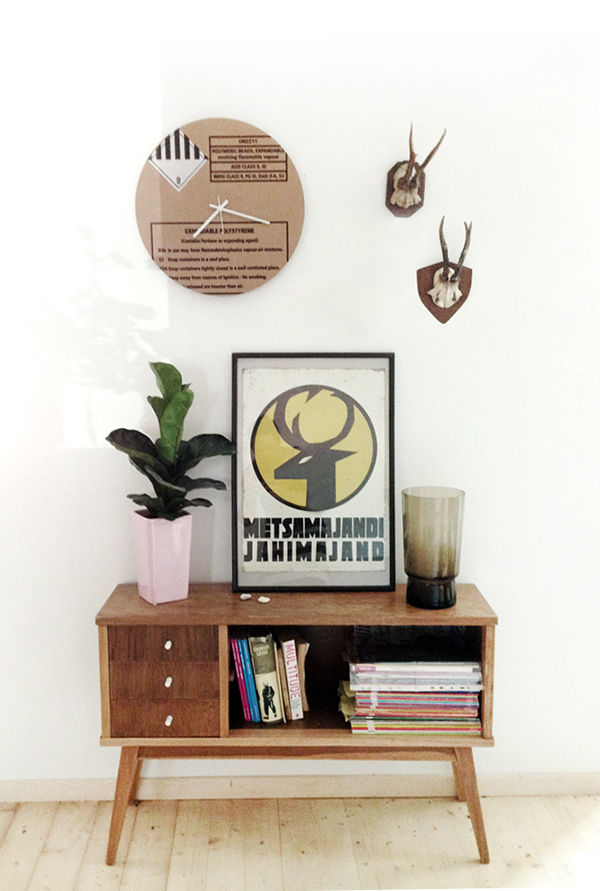
At what (x,y) coordinates should I click in order to perform the action: click on vase. Please return your answer as a coordinate pair (x, y). The width and height of the screenshot is (600, 891). Looking at the image, I should click on (168, 552).